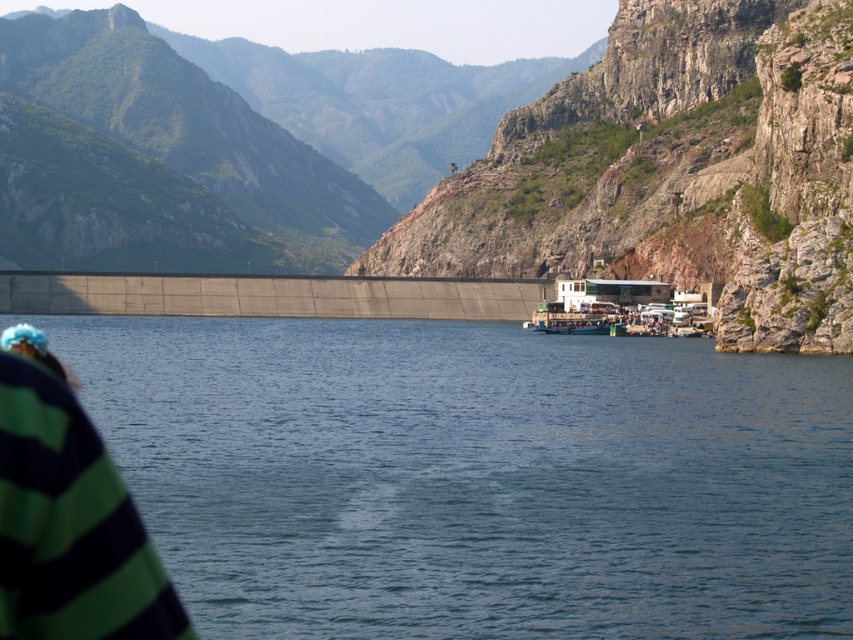
You are standing at the base of the rocky cliff at upper right and want to walk to the green striped sweater at lower left. Which direction should you head to reach the sweater?

The rocky cliff at upper right is positioned on the right side of green striped sweater at lower left. To reach the sweater, you should head to the left.

In the scene shown: You are a photographer planning to capture the blue water at center and the rocky cliff at upper right in a single shot. Based on their positions, which object will appear closer to the camera in the photo?

The blue water at center will appear closer to the camera because it is positioned in front of the rocky cliff at upper right.

You are an observer standing at the center of the dam. You see the rocky cliff at upper right and the green striped sweater at lower left. Which object is larger in size?

The rocky cliff at upper right is bigger than the green striped sweater at lower left.